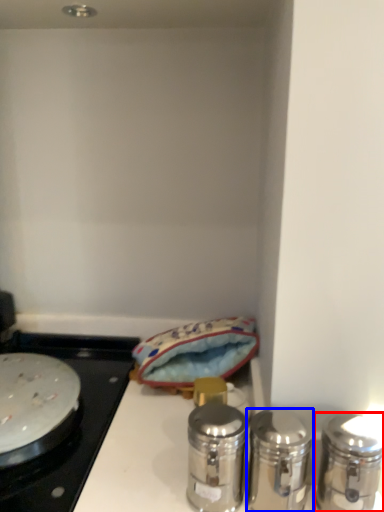
Question: Which object is closer to the camera taking this photo, salt and pepper shakers (highlighted by a red box) or salt and pepper shakers (highlighted by a blue box)?

Choices:
 (A) salt and pepper shakers
 (B) salt and pepper shakers

Answer: (A)